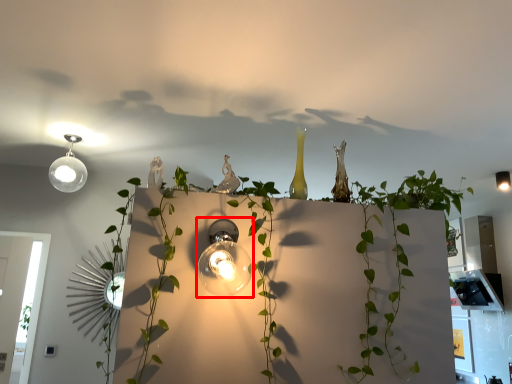
Question: Observing the image, what is the correct spatial positioning of lamp (annotated by the red box) in reference to lamp?

Choices:
 (A) right
 (B) left

Answer: (B)